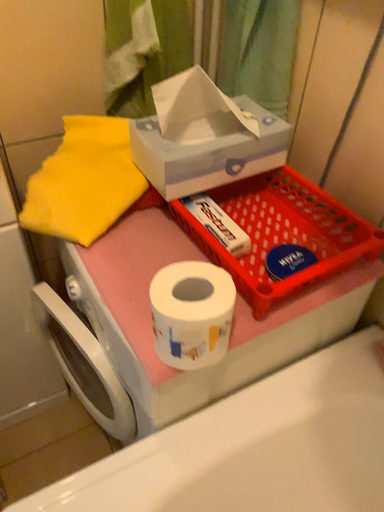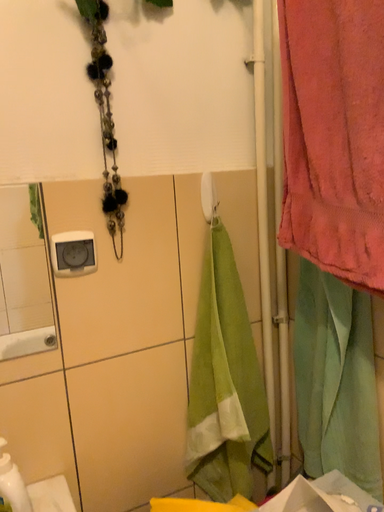
Question: How did the camera likely rotate when shooting the video?

Choices:
 (A) rotated upward
 (B) rotated downward

Answer: (A)